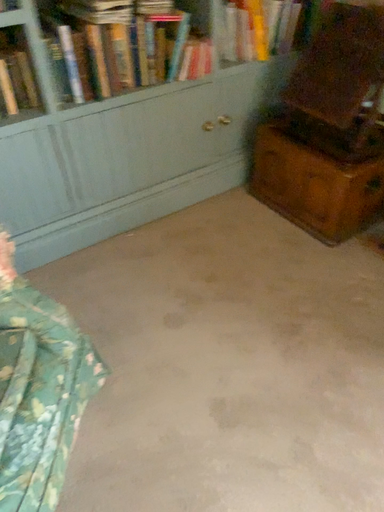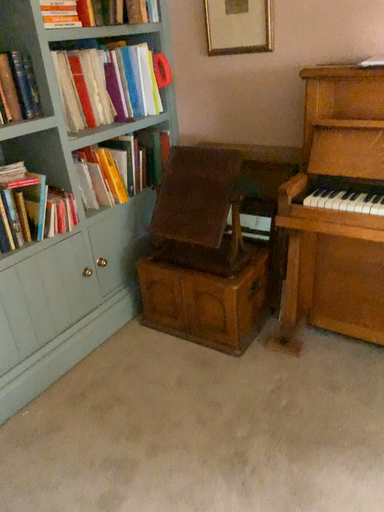
Question: How did the camera likely rotate when shooting the video?

Choices:
 (A) rotated downward
 (B) rotated upward

Answer: (B)